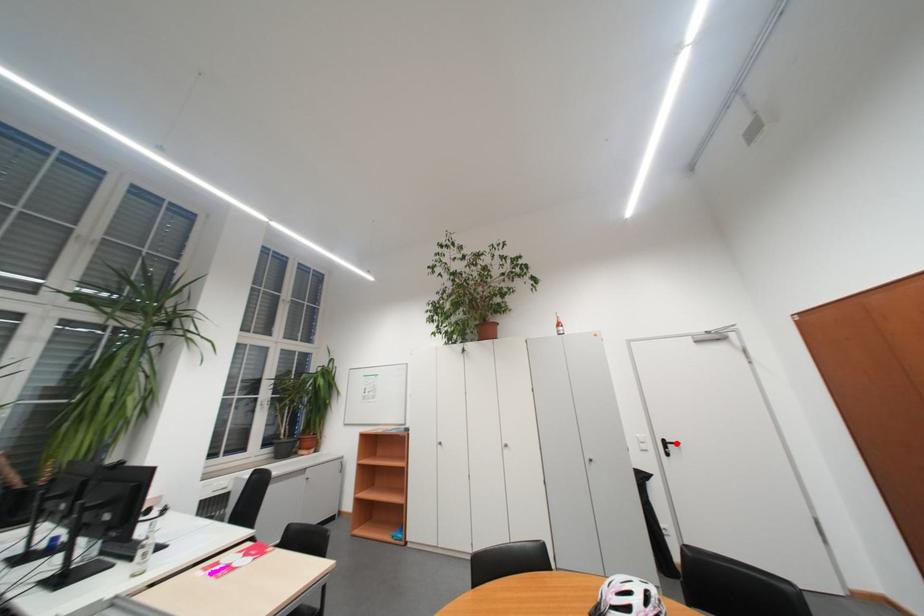
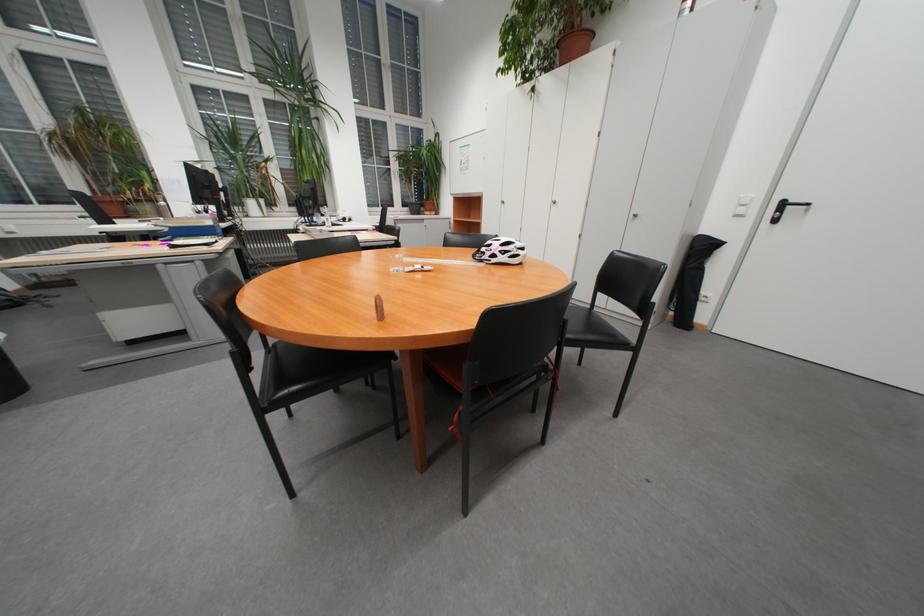
The point at the highlighted location is marked in the first image. Where is the corresponding point in the second image?

(795, 205)